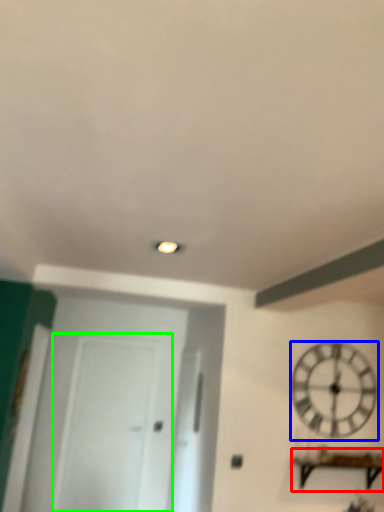
Question: Considering the real-world distances, which object is farthest from furniture (highlighted by a red box)? wall clock (highlighted by a blue box) or glass door (highlighted by a green box)?

Choices:
 (A) wall clock
 (B) glass door

Answer: (B)